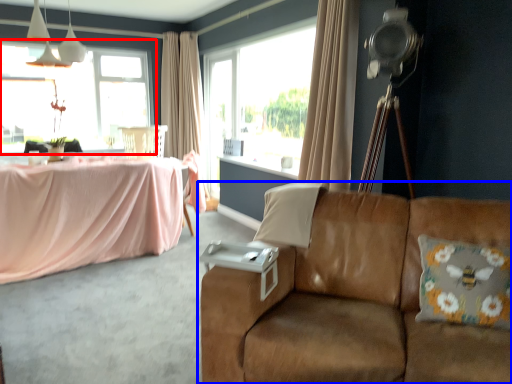
Question: Which point is further to the camera, window (highlighted by a red box) or studio couch (highlighted by a blue box)?

Choices:
 (A) window
 (B) studio couch

Answer: (A)